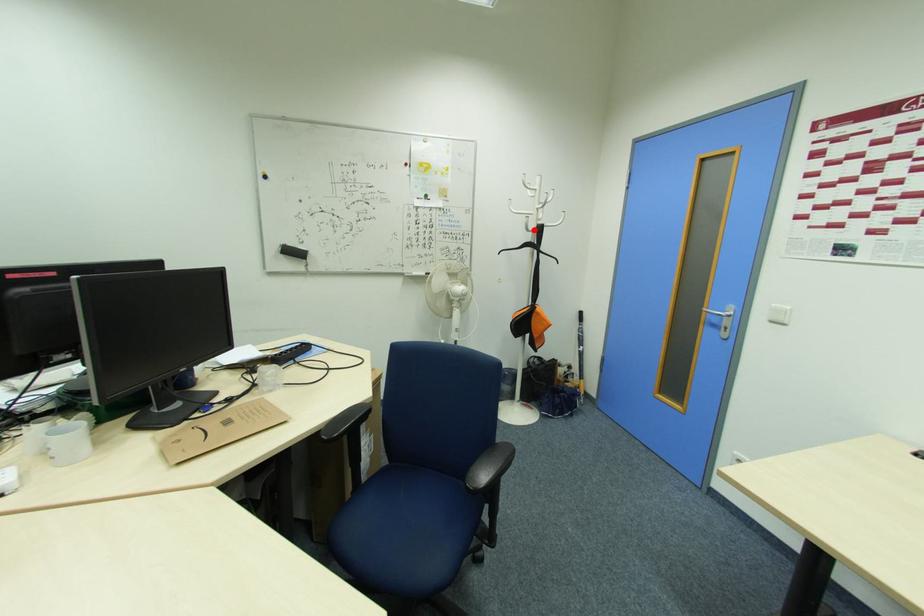
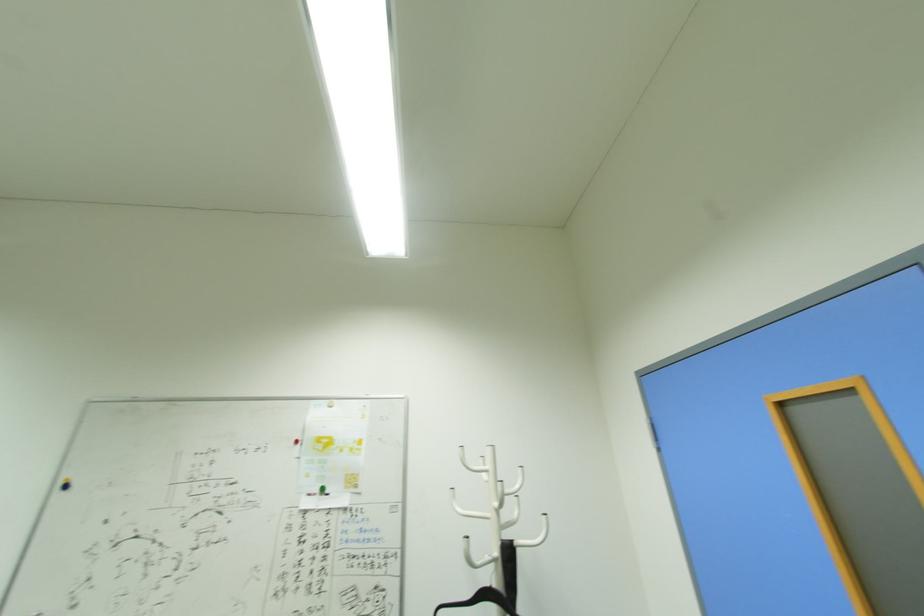
In the second image, find the point that corresponds to the highlighted location in the first image.

(481, 564)